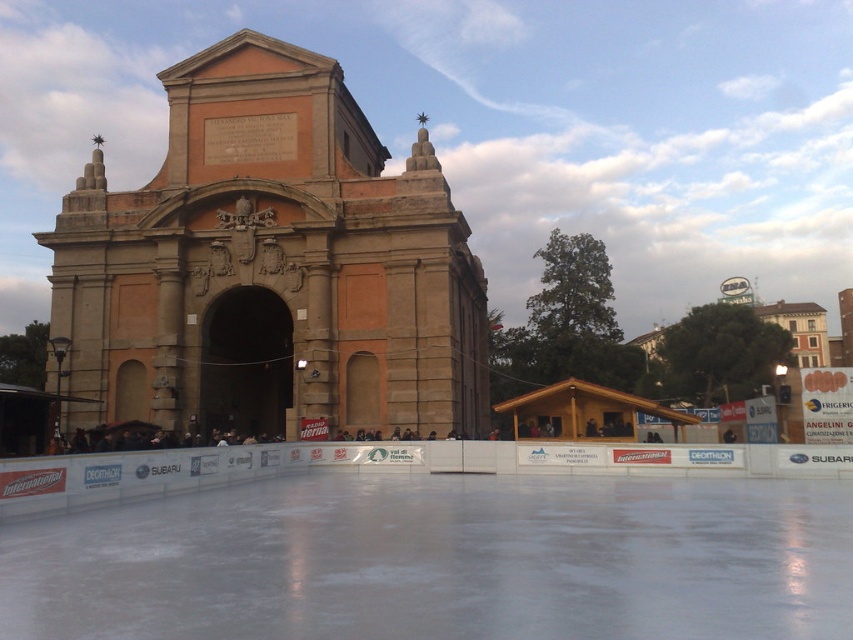
You are standing in front of the brown stone church at center and the white smooth ice at center. Which one is taller?

The brown stone church at center is taller than the white smooth ice at center.

You are standing on the white smooth ice at center and want to reach the brown stone church at center. Is the church directly on the ice?

Yes, the brown stone church at center is positioned over white smooth ice at center, so it is directly on the ice.